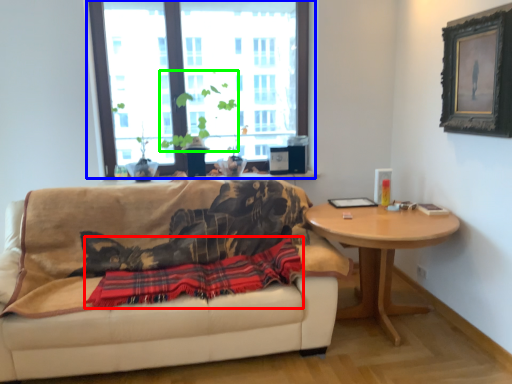
Question: Which object is positioned farthest from plaid (highlighted by a red box)? Select from window (highlighted by a blue box) and plant (highlighted by a green box).

Choices:
 (A) window
 (B) plant

Answer: (A)